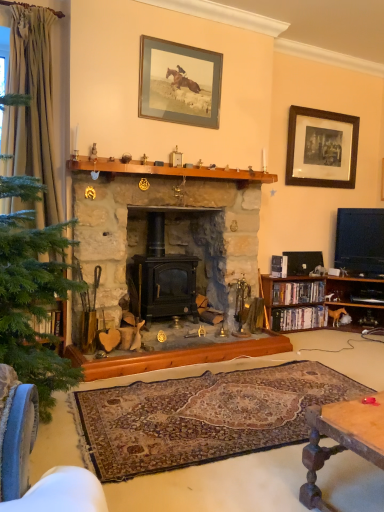
The height and width of the screenshot is (512, 384). I want to click on empty space that is ontop of hardcover books at right, which appears as the 2th book when ordered from the bottom (from a real-world perspective), so pyautogui.click(x=296, y=283).